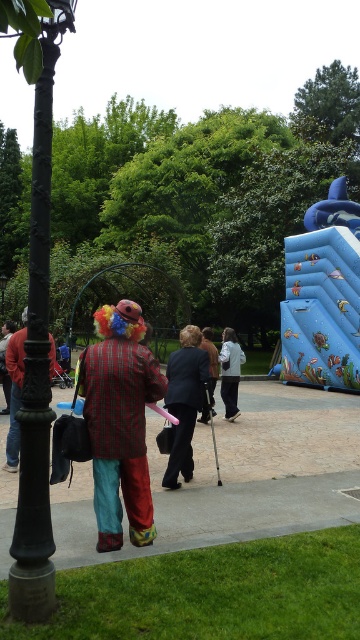
Does black wrought iron lamp post at left come in front of plaid fabric clown at center?

That is True.

Between point (47, 56) and point (110, 429), which one is positioned in front?

Point (47, 56) is more forward.

Describe the element at coordinates (38, 358) in the screenshot. I see `black wrought iron lamp post at left` at that location.

What are the coordinates of `black wrought iron lamp post at left` in the screenshot? It's located at (38, 358).

Between point (159, 365) and point (205, 346), which one is positioned in front?

Point (159, 365) is more forward.

Can you confirm if plaid fabric clown at center is taller than dark gray suit at center?

Yes.

Locate an element on the screen. plaid fabric clown at center is located at coordinates pos(119,420).

The image size is (360, 640). In order to click on plaid fabric clown at center in this screenshot , I will do `click(119, 420)`.

Can you confirm if plaid fabric clown at center is taller than light gray fabric jacket at center?

Yes.

Does point (110, 358) lie in front of point (234, 353)?

Yes, it is in front of point (234, 353).

The height and width of the screenshot is (640, 360). I want to click on plaid fabric clown at center, so (x=119, y=420).